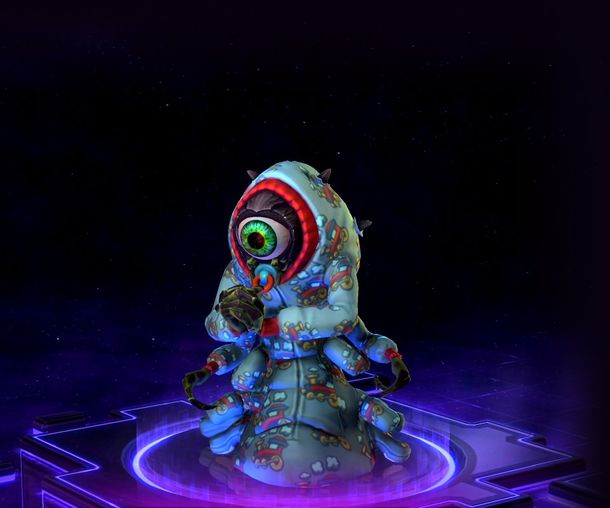
Find the location of a particular element. purple light is located at coordinates (135, 472), (449, 466).